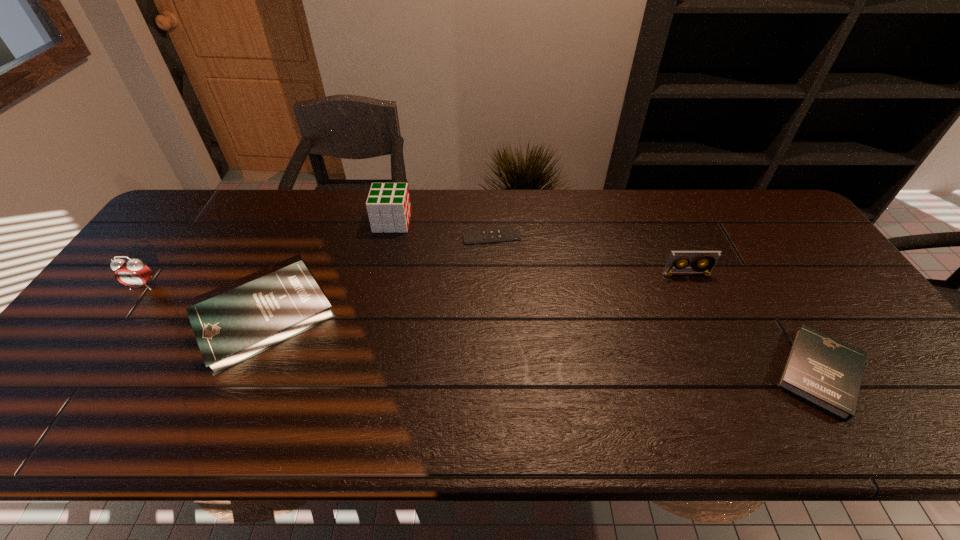
If equal spacing is the goal by inserting an additional book among them, please point out a vacant space for this new book. Please provide its 2D coordinates. Your answer should be formatted as a tuple, i.e. [(x, y)], where the tuple contains the x and y coordinates of a point satisfying the conditions above.

[(527, 343)]